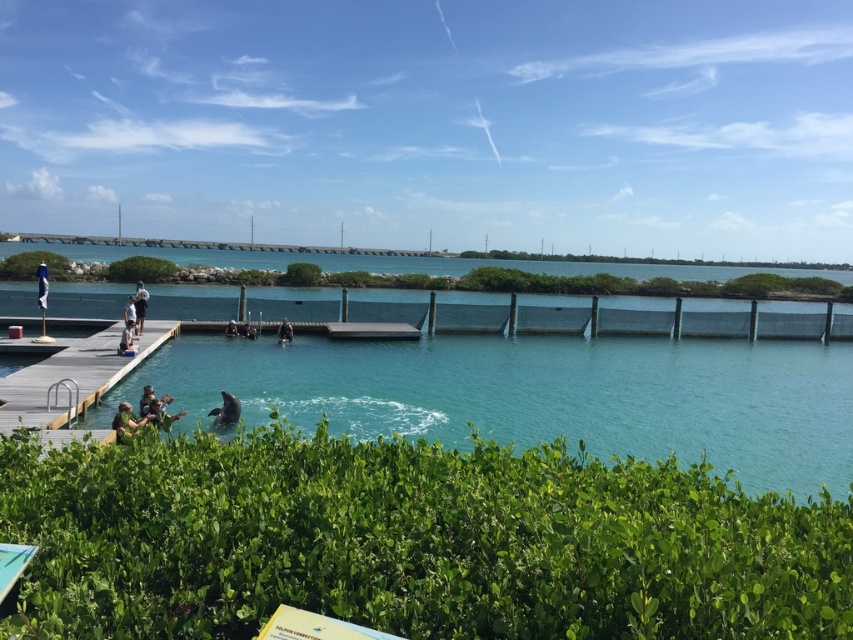
Based on the photo, you are a photographer trying to capture a clear shot of the blue fabric umbrella at upper center. However, the green leafy bush at left is blocking your view. Can you determine which object is taller and might be causing the obstruction?

The green leafy bush at left is much taller than the blue fabric umbrella at upper center, so it is likely blocking the view of the umbrella.

You are a photographer trying to capture a clear shot of the green fabric shirt at lower left without the green leafy bush at center blocking it. Which object should you move to the right to achieve this?

The green leafy bush at center is positioned on the left side of green fabric shirt at lower left. To avoid blocking the shirt, you should move the green leafy bush at center to the right.

You are a photographer trying to capture a clear view of the turquoise water and the wooden dock. You notice the green leafy bush at left and the blue fabric umbrella at upper center might block your shot. Which object would you need to move to get a clearer view of the water and dock?

The green leafy bush at left has a larger size compared to blue fabric umbrella at upper center, so moving the green leafy bush at left would provide a clearer view of the water and dock since it is bigger and more obstructive.